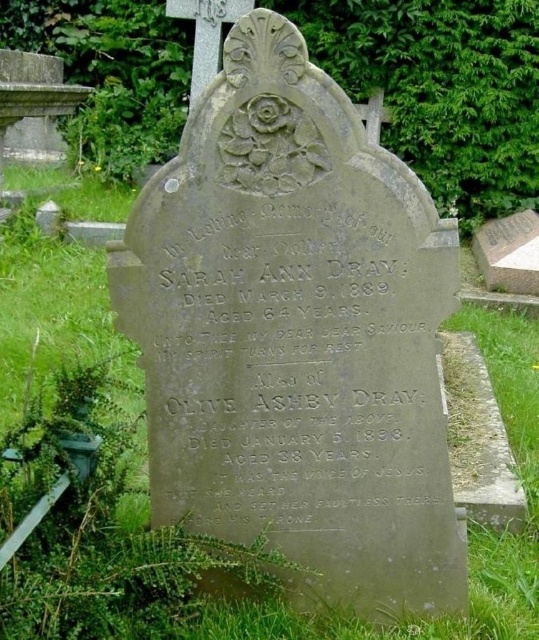
You are standing in a cemetery and see the gray stone inscription at center and the green grass at center. Which object is shorter in height?

The gray stone inscription at center is shorter than the green grass at center.

Looking at this image, you are standing in a cemetery and see the gray stone inscription at center and the green grass at center. Which object is located to the right of the other?

The gray stone inscription at center is positioned on the right side of green grass at center.

You are a historian examining the image of a cemetery. You notice the gray stone inscription at center and the green grass at center. Which object appears narrower in the image?

The gray stone inscription at center is thinner than the green grass at center, so the gray stone inscription at center appears narrower.